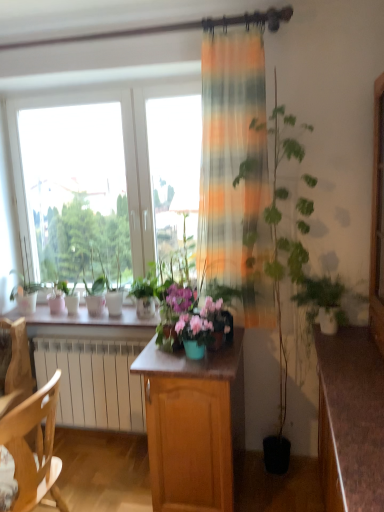
Where is `free space underneath matte plastic flower box at center (from a real-world perspective)`? The width and height of the screenshot is (384, 512). free space underneath matte plastic flower box at center (from a real-world perspective) is located at coordinates (201, 357).